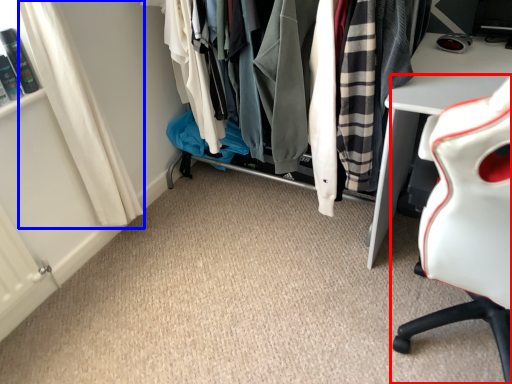
Question: Among these objects, which one is nearest to the camera, chair (highlighted by a red box) or curtain (highlighted by a blue box)?

Choices:
 (A) chair
 (B) curtain

Answer: (A)